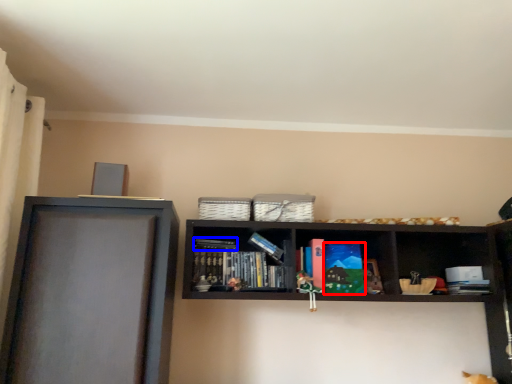
Question: Which object is closer to the camera taking this photo, paperback book (highlighted by a red box) or book (highlighted by a blue box)?

Choices:
 (A) paperback book
 (B) book

Answer: (A)